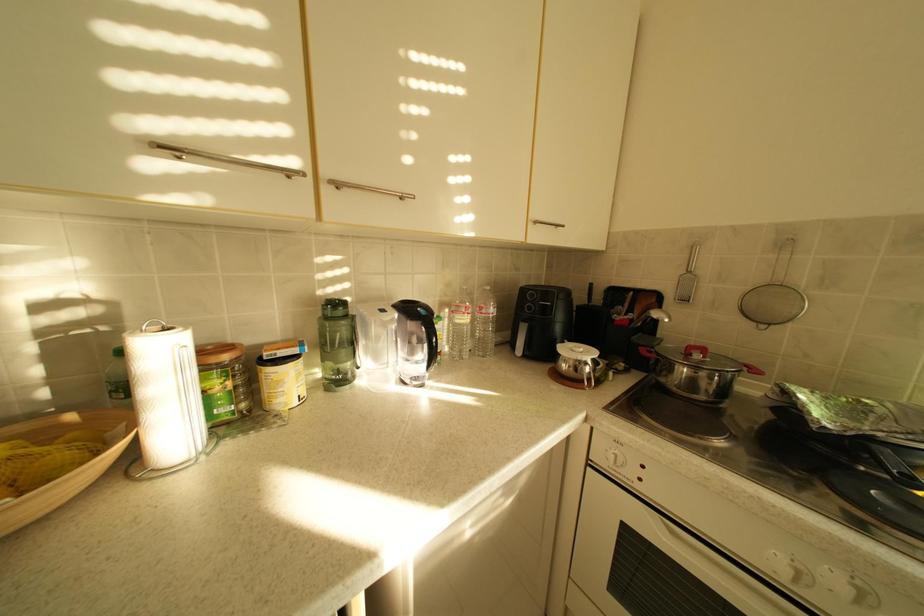
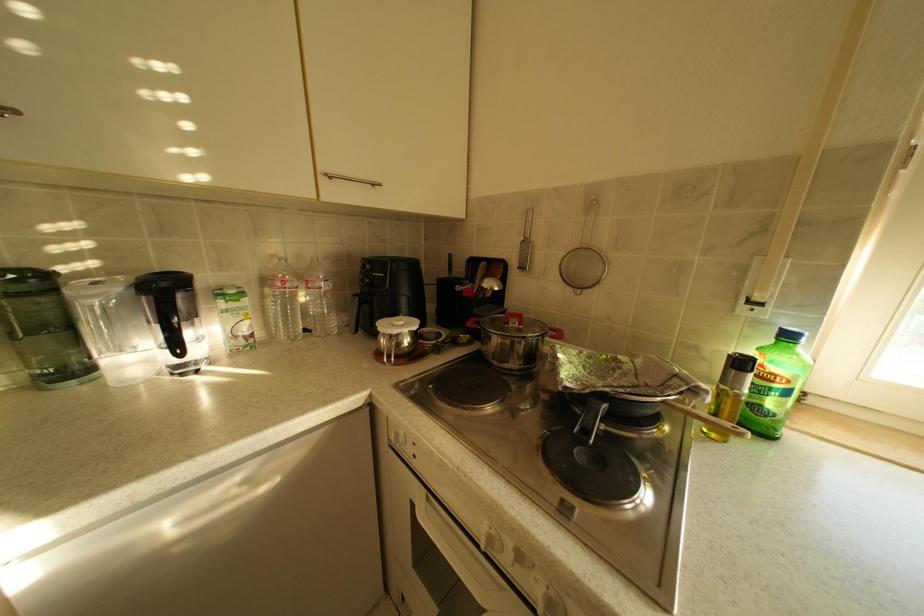
Question: The images are taken continuously from a first-person perspective. In which direction is your viewpoint rotating?

Choices:
 (A) Left
 (B) Right
 (C) Up
 (D) Down

Answer: (B)